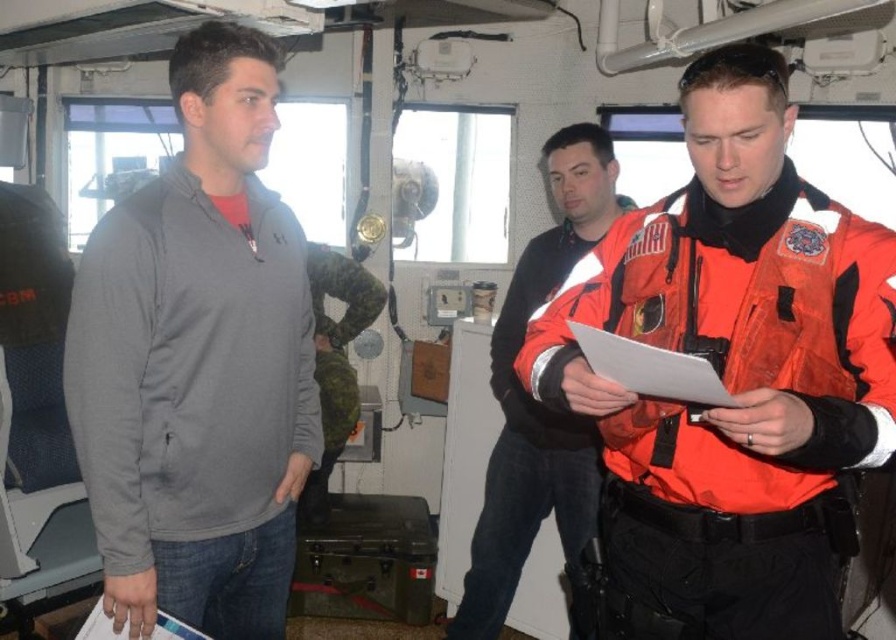
Which is more to the left, orange fabric life jacket at center or orange reflective jacket at center?

orange reflective jacket at center is more to the left.

Which of these two, orange fabric life jacket at center or orange reflective jacket at center, stands shorter?

Standing shorter between the two is orange fabric life jacket at center.

Between point (830, 333) and point (498, 467), which one is positioned behind?

Positioned behind is point (498, 467).

Locate an element on the screen. orange fabric life jacket at center is located at coordinates (737, 337).

Can you confirm if gray fleece jacket at left is wider than orange fabric life jacket at center?

No, gray fleece jacket at left is not wider than orange fabric life jacket at center.

At what (x,y) coordinates should I click in order to perform the action: click on gray fleece jacket at left. Please return your answer as a coordinate pair (x, y). The height and width of the screenshot is (640, 896). Looking at the image, I should click on (x=197, y=362).

Between point (857, 401) and point (363, 296), which one is positioned behind?

Positioned behind is point (363, 296).

Who is positioned more to the right, orange fabric life jacket at center or camouflage fabric uniform at center?

orange fabric life jacket at center

The width and height of the screenshot is (896, 640). Identify the location of orange fabric life jacket at center. (737, 337).